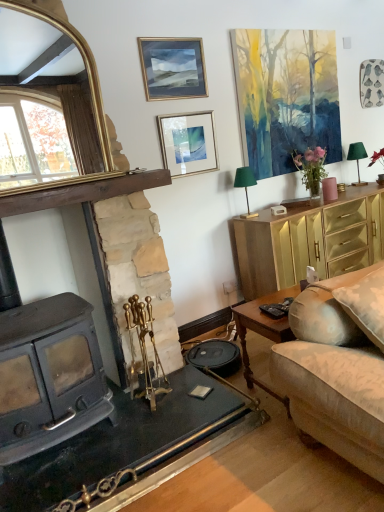
Question: Looking at their shapes, would you say pink matte vase at upper right is wider or thinner than watercolor painting at upper right, the first picture frame positioned from the right?

Choices:
 (A) wide
 (B) thin

Answer: (A)

Question: Does point (322, 182) appear closer or farther from the camera than point (284, 129)?

Choices:
 (A) closer
 (B) farther

Answer: (B)

Question: Which object is positioned closest to the matte silver picture frame at upper center, which ranks as the second picture frame in left-to-right order?

Choices:
 (A) gold/gilded mirror at upper left
 (B) green fabric lampshade at upper right, acting as the 2th lamp starting from the right
 (C) wooden coffee table at lower right
 (D) green fabric lampshade at upper right, placed as the first lamp when sorted from top to bottom
 (E) gold-framed picture at upper center, marked as the third picture frame in a right-to-left arrangement

Answer: (E)

Question: Considering the real-world distances, which object is closest to the pink matte vase at upper right?

Choices:
 (A) black plastic remote control at lower right
 (B) green fabric lampshade at upper right, acting as the 2th lamp starting from the right
 (C) green fabric lampshade at upper right, the second lamp from the left
 (D) watercolor painting at upper right, the first picture frame positioned from the right
 (E) gold-framed picture at upper center, which appears as the first picture frame when viewed from the left

Answer: (C)